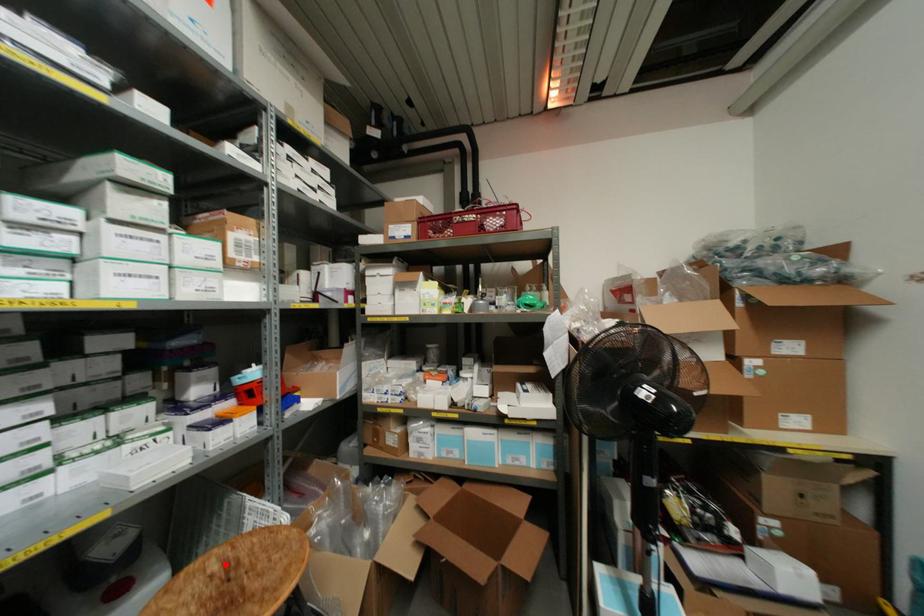
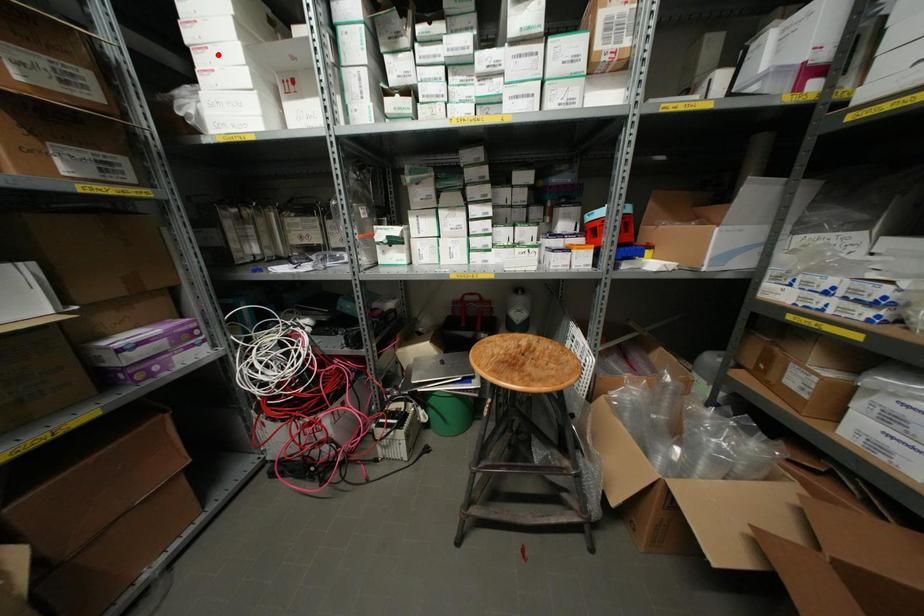
I am providing you with two images of the same scene from different viewpoints. A red point is marked on the first image and another point is marked on the second image. Do the highlighted points in image1 and image2 indicate the same real-world spot?

No